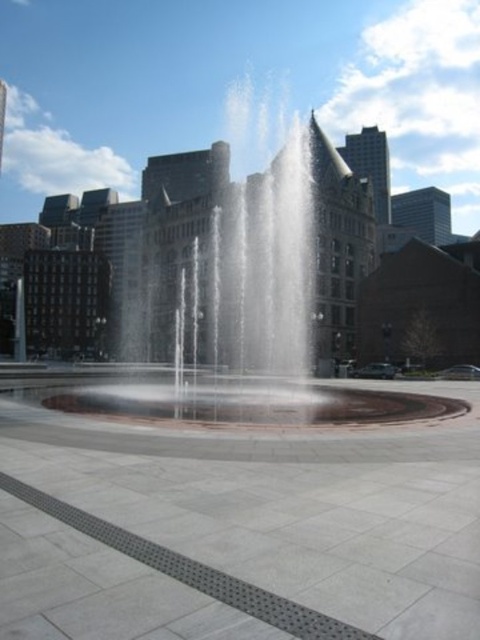
In order to click on gray concrete pavement at center in this screenshot , I will do (x=241, y=525).

Who is taller, gray concrete pavement at center or clear water fountain at center?

clear water fountain at center is taller.

Which is behind, point (391, 464) or point (213, 328)?

The point (213, 328) is behind.

Where is `gray concrete pavement at center`? This screenshot has height=640, width=480. gray concrete pavement at center is located at coordinates (241, 525).